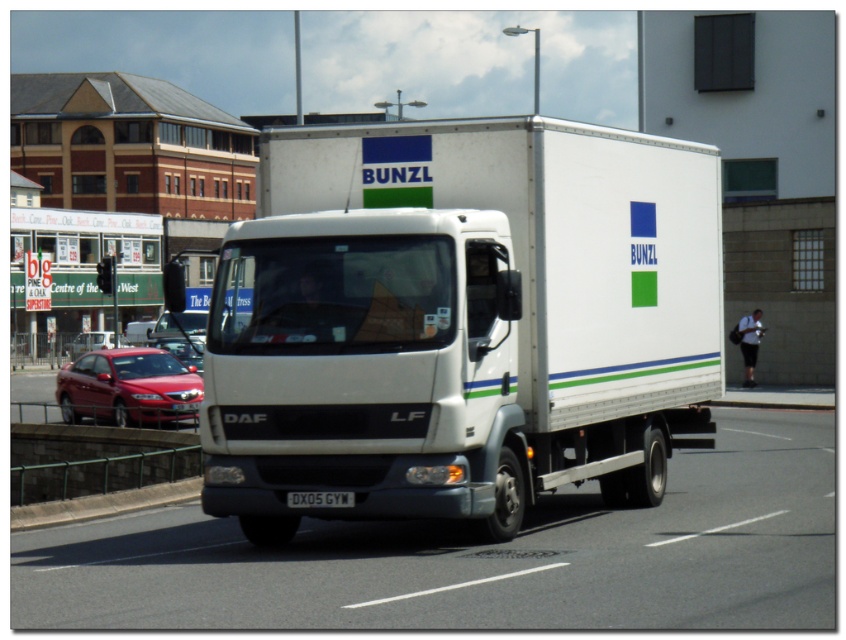
Does white matte truck at center have a smaller size compared to shiny red sedan at lower left?

Yes.

Is point (440, 243) positioned in front of point (147, 413)?

Yes, point (440, 243) is closer to viewer.

Locate an element on the screen. Image resolution: width=846 pixels, height=640 pixels. white matte truck at center is located at coordinates (460, 321).

Who is positioned more to the left, shiny red sedan at lower left or white plastic license plate at center?

shiny red sedan at lower left is more to the left.

Does point (163, 378) come behind point (320, 493)?

Yes, it is behind point (320, 493).

Locate an element on the screen. This screenshot has height=640, width=846. shiny red sedan at lower left is located at coordinates (128, 387).

Does point (277, 449) come closer to viewer compared to point (303, 508)?

Yes, it is.

This screenshot has width=846, height=640. What do you see at coordinates (460, 321) in the screenshot?
I see `white matte truck at center` at bounding box center [460, 321].

Is point (462, 172) positioned behind point (316, 506)?

Yes, it is.

Identify the location of white matte truck at center. This screenshot has height=640, width=846. (460, 321).